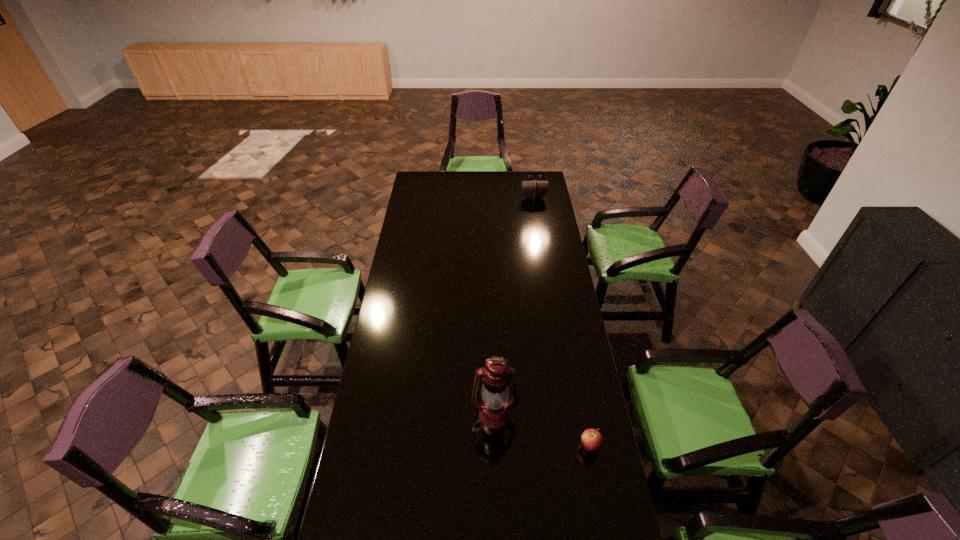
Locate an element on the screen. The width and height of the screenshot is (960, 540). free space between the nearest object and the oil lamp is located at coordinates (542, 431).

The image size is (960, 540). Find the location of `vacant area that lies between the tallest object and the pouch`. vacant area that lies between the tallest object and the pouch is located at coordinates (514, 307).

Locate an element on the screen. This screenshot has width=960, height=540. free space that is in between the shortest object and the second tallest object is located at coordinates (562, 322).

Locate an element on the screen. The image size is (960, 540). vacant area between the nearest object and the pouch is located at coordinates (562, 322).

Where is `empty location between the leftmost object and the second tallest object`? The height and width of the screenshot is (540, 960). empty location between the leftmost object and the second tallest object is located at coordinates (514, 307).

This screenshot has width=960, height=540. I want to click on object that can be found as the closest to the apple, so click(x=494, y=414).

The height and width of the screenshot is (540, 960). I want to click on object that is the second closest one to the farthest object, so click(592, 440).

What are the coordinates of `vacant position in the image that satisfies the following two spatial constraints: 1. with the flap open on the second tallest object; 2. on the left side of the shortest object` in the screenshot? It's located at (574, 447).

Find the location of `free space that satisfies the following two spatial constraints: 1. on the front side of the oil lamp; 2. on the left side of the nearest object`. free space that satisfies the following two spatial constraints: 1. on the front side of the oil lamp; 2. on the left side of the nearest object is located at coordinates (495, 447).

Find the location of a particular element. vacant space that satisfies the following two spatial constraints: 1. with the flap open on the pouch; 2. on the right side of the nearest object is located at coordinates (574, 447).